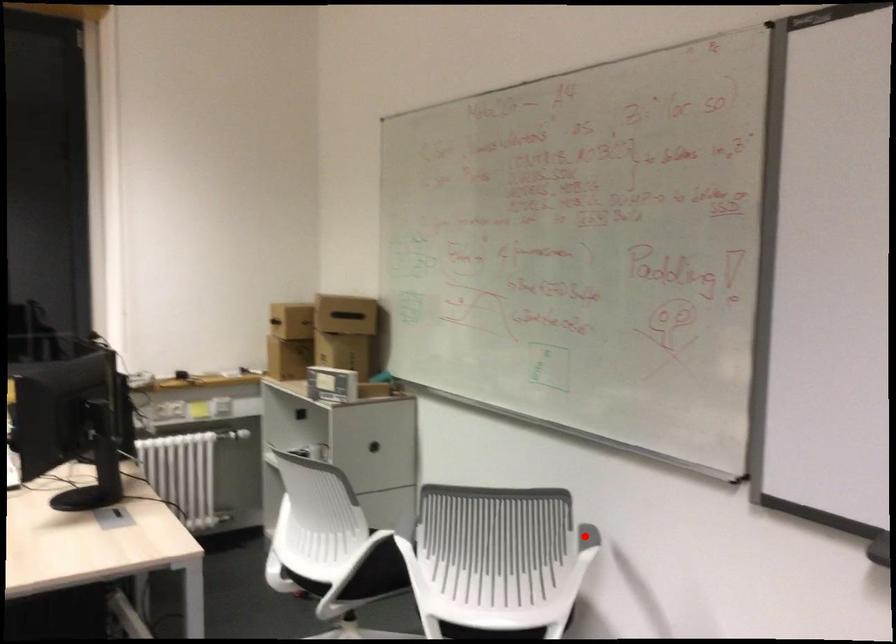
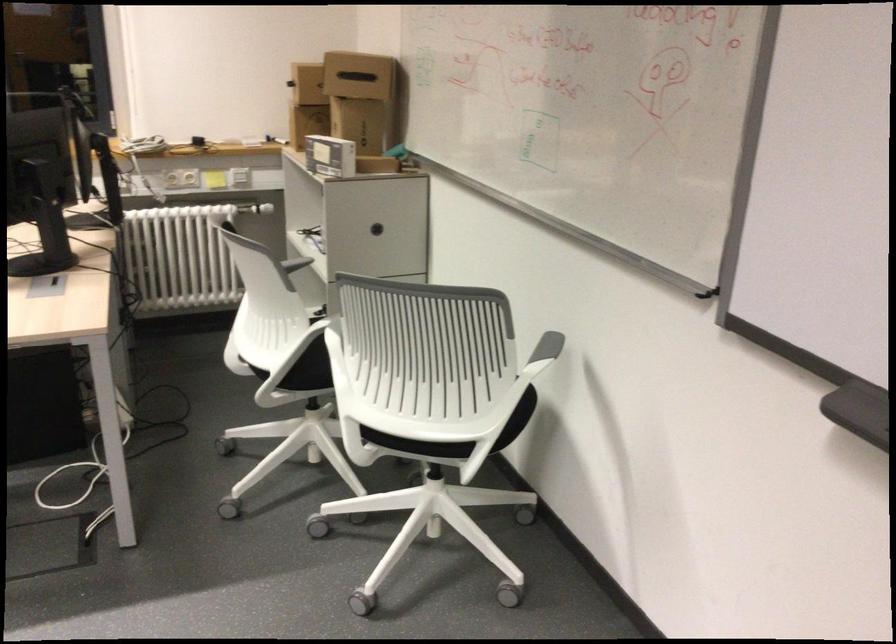
Locate, in the second image, the point that corresponds to the highlighted location in the first image.

(547, 346)